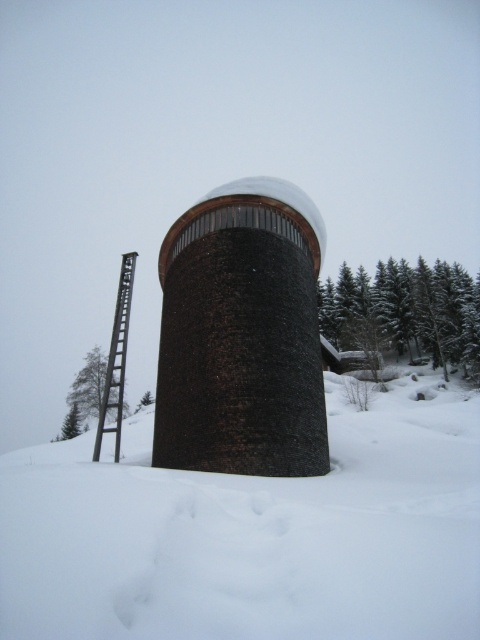
Question: Based on their relative distances, which object is farther from the brown textured tower at center?

Choices:
 (A) green textured trees at right
 (B) white powdery snow at lower center
 (C) green matte tree at left

Answer: (A)

Question: Is brown textured tower at center smaller than green textured trees at right?

Choices:
 (A) no
 (B) yes

Answer: (B)

Question: Which point is closer to the camera taking this photo?

Choices:
 (A) (342, 458)
 (B) (397, 339)
 (C) (249, 467)
 (D) (124, 412)

Answer: (C)

Question: Is white powdery snow at lower center smaller than green textured trees at right?

Choices:
 (A) no
 (B) yes

Answer: (B)

Question: Can you confirm if white powdery snow at lower center is positioned to the right of green textured trees at right?

Choices:
 (A) no
 (B) yes

Answer: (A)

Question: Which of the following is the closest to the observer?

Choices:
 (A) white powdery snow at lower center
 (B) green matte tree at left
 (C) green textured trees at right

Answer: (A)